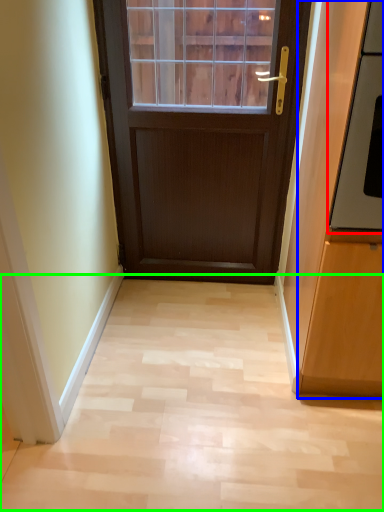
Question: Which object is the farthest from oven (highlighted by a red box)? Choose among these: cabinetry (highlighted by a blue box) or corridor (highlighted by a green box).

Choices:
 (A) cabinetry
 (B) corridor

Answer: (B)